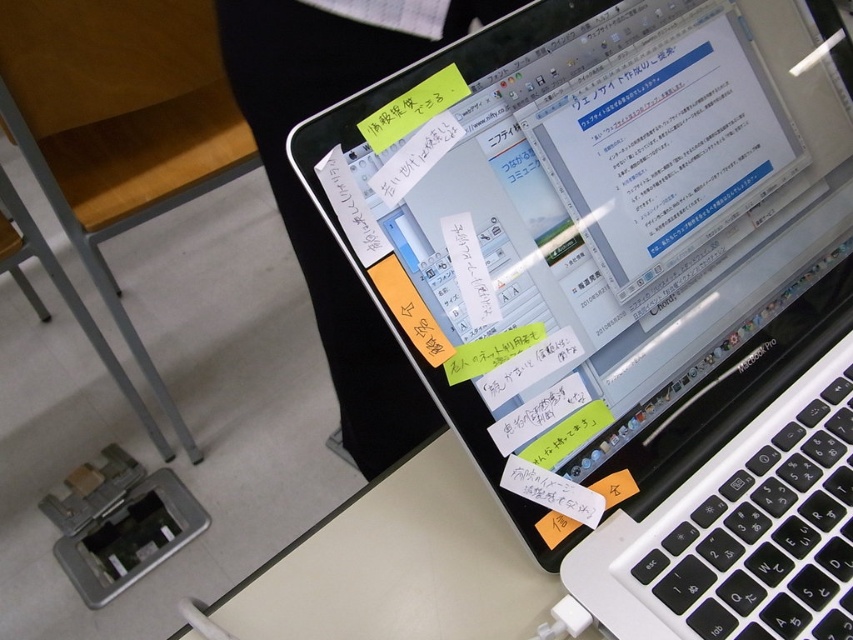
Question: Which point is farther from the camera taking this photo?

Choices:
 (A) click(679, 362)
 (B) click(473, 355)
 (C) click(419, 109)

Answer: (A)

Question: In this image, where is yellow sticky note at upper center located relative to yellow sticky note at center?

Choices:
 (A) above
 (B) below

Answer: (A)

Question: Does yellow sticky note at upper center appear over yellow sticky note at center?

Choices:
 (A) no
 (B) yes

Answer: (B)

Question: Does yellow sticky note at upper center have a smaller size compared to yellow sticky note at center?

Choices:
 (A) yes
 (B) no

Answer: (B)

Question: Which point is closer to the camera taking this photo?

Choices:
 (A) (415, 90)
 (B) (477, 371)

Answer: (A)

Question: Which of the following is the farthest from the observer?

Choices:
 (A) (410, 339)
 (B) (422, 90)

Answer: (B)